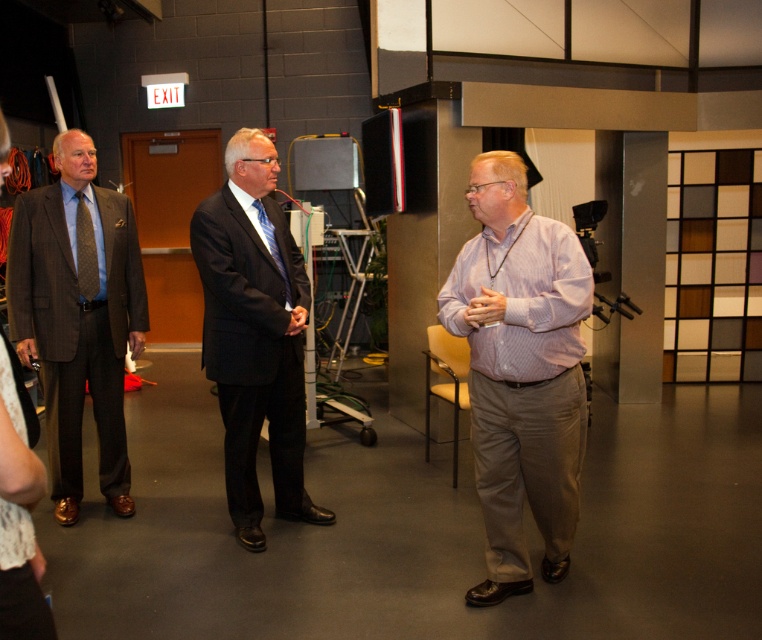
You are a photographer setting up for an event. You notice two items in the scene that are part of a person wearing a matte brown suit at left and a brown textured tie at left. Which item is located to the left of the other?

The matte brown suit at left is positioned on the left side of brown textured tie at left, so the matte brown suit at left is to the left of the brown textured tie at left.

You are a stagehand who needs to place a new microphone stand exactly at the coordinates mentioned in the scene. Where should you position it relative to the matte black suit at center?

The microphone stand should be positioned at the coordinates specified for the matte black suit at center, which is at point (255, 333).

You are a stagehand who needs to place a 1.2 meter long microphone stand between the matte brown suit at left and the blue striped tie at center. Can the microphone stand fit between them without moving either object?

The distance between the matte brown suit at left and the blue striped tie at center is 1.06 meters. Since the microphone stand is 1.2 meters long, it cannot fit between them without moving either object because the space is shorter than the stand.